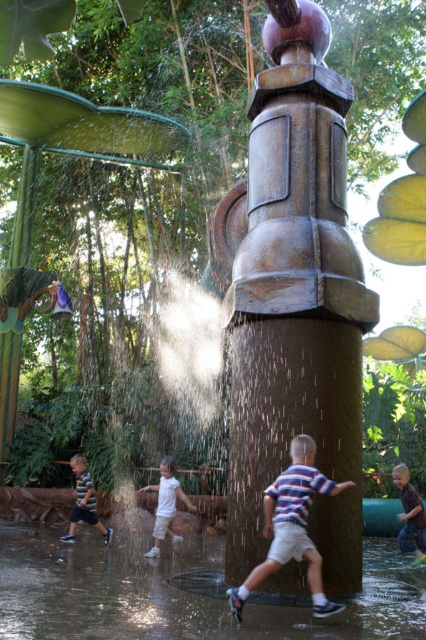
From the picture: Does metallic water at center appear over striped cotton shirt at lower left?

Indeed, metallic water at center is positioned over striped cotton shirt at lower left.

Which is more to the right, metallic water at center or striped cotton shirt at lower left?

metallic water at center

Is point (69, 593) closer to viewer compared to point (71, 456)?

That is True.

The width and height of the screenshot is (426, 640). I want to click on metallic water at center, so click(178, 593).

Between metallic water at center and brown cotton shirt at center, which one has less height?

metallic water at center

Which is above, metallic water at center or brown cotton shirt at center?

metallic water at center is higher up.

Identify the location of metallic water at center. The height and width of the screenshot is (640, 426). (178, 593).

Between striped cotton shirt at center and white cotton shirt at center, which one appears on the left side from the viewer's perspective?

white cotton shirt at center

Is striped cotton shirt at center smaller than white cotton shirt at center?

No.

Between point (310, 493) and point (189, 506), which one is positioned in front?

Point (310, 493)

Where is `striped cotton shirt at center`? The height and width of the screenshot is (640, 426). striped cotton shirt at center is located at coordinates (291, 525).